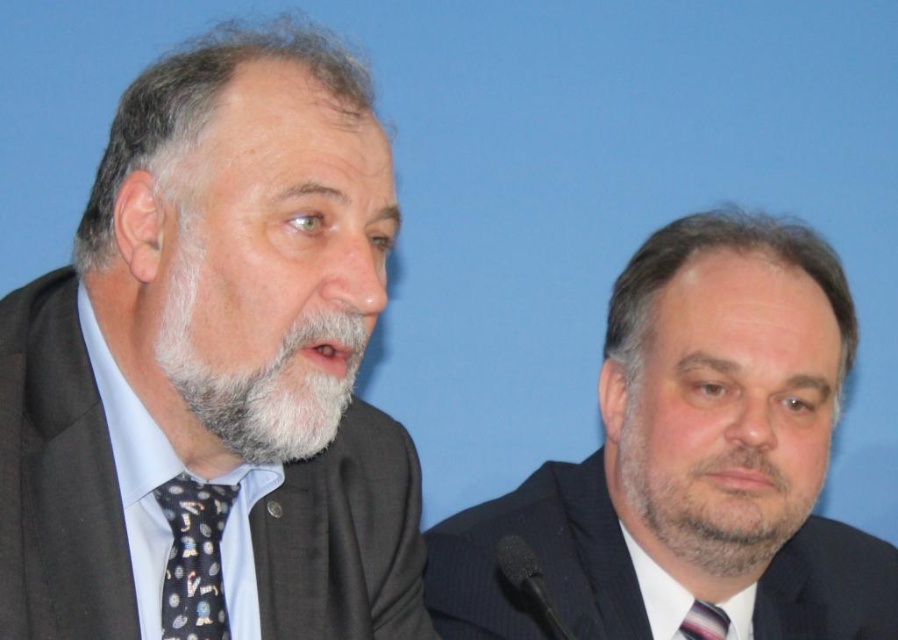
You are organizing a formal event and need to ensure that all participants have ties that meet specific size requirements. You have two ties available for selection. The black dotted tie at left and the striped fabric tie at center. Which tie should you choose if you need a larger one for a more formal occasion?

The black dotted tie at left is larger in size than the striped fabric tie at center, so you should choose the black dotted tie at left for a more formal occasion requiring a larger tie.

You are standing 36.25 inches away from the point marked at coordinates point (x=260, y=484). If you want to take a photo of the two people in the scene, will you be able to capture both of them in the frame?

Yes, because the point (x=260, y=484) is 36.25 inches away from you, and the two people are positioned at that point, so they will both be in the frame.

What are the coordinates of the black dotted tie at left?

The coordinates of the black dotted tie at left are at point (x=192, y=557).